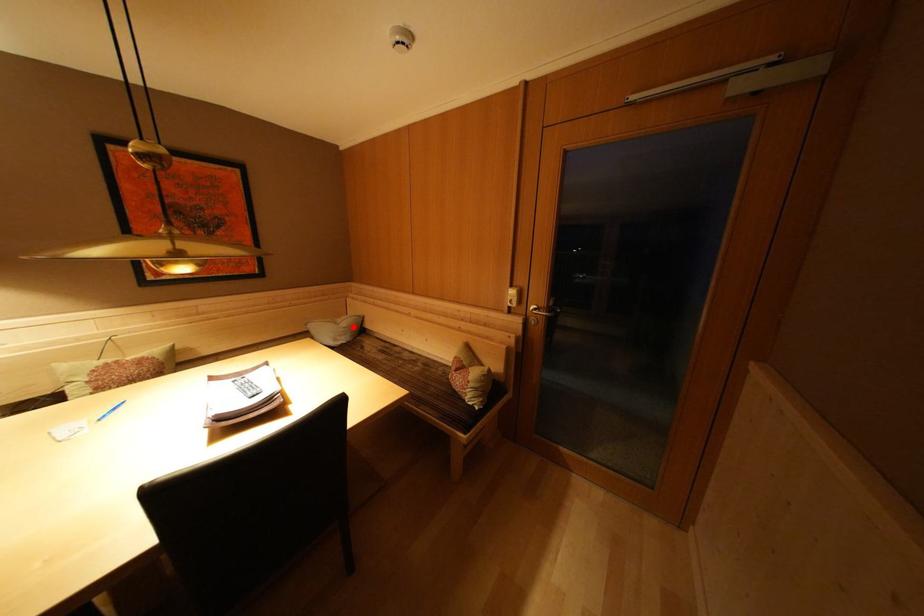
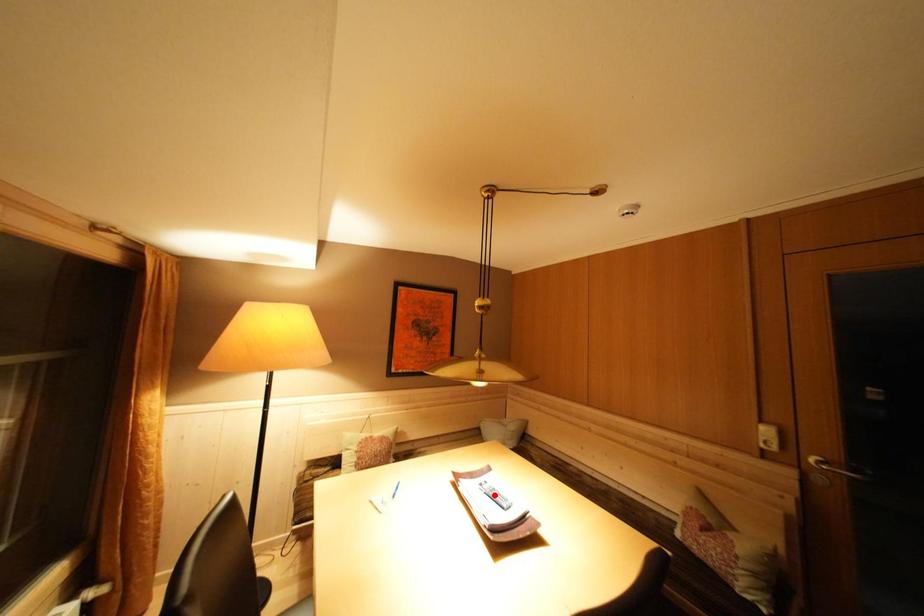
I am providing you with two images of the same scene from different viewpoints. A red point is marked on the first image and another point is marked on the second image. Do the highlighted points in image1 and image2 indicate the same real-world spot?

No